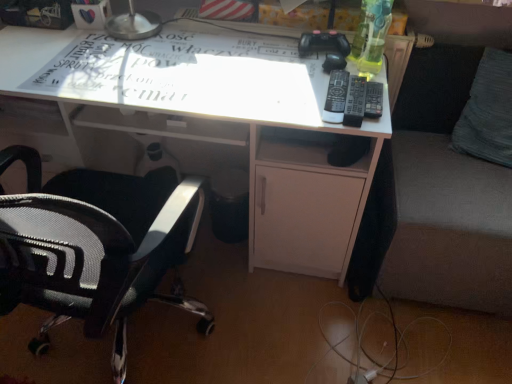
Question: Is black plastic remote at right, the 2th remote viewed from the left, aimed at black plastic remote at upper right, which ranks as the 1th remote in left-to-right order?

Choices:
 (A) no
 (B) yes

Answer: (A)

Question: Is black plastic remote at upper right, which ranks as the 1th remote in left-to-right order, at the back of black plastic remote at right, the second remote when ordered from right to left?

Choices:
 (A) yes
 (B) no

Answer: (B)

Question: Is black plastic remote at right, the second remote when ordered from right to left, beside black plastic remote at upper right, the third remote from the right?

Choices:
 (A) yes
 (B) no

Answer: (A)

Question: From the image's perspective, would you say black plastic remote at right, the second remote when ordered from right to left, is positioned over black plastic remote at upper right, the third remote from the right?

Choices:
 (A) no
 (B) yes

Answer: (A)

Question: Can you confirm if black plastic remote at right, the 2th remote viewed from the left, is taller than black plastic remote at upper right, which ranks as the 1th remote in left-to-right order?

Choices:
 (A) no
 (B) yes

Answer: (B)

Question: Relative to dark gray fabric couch at right, is white paper at center in front or behind?

Choices:
 (A) behind
 (B) front

Answer: (A)

Question: In terms of width, does white paper at center look wider or thinner when compared to dark gray fabric couch at right?

Choices:
 (A) wide
 (B) thin

Answer: (B)

Question: Is white paper at center situated inside dark gray fabric couch at right or outside?

Choices:
 (A) outside
 (B) inside

Answer: (A)

Question: From a real-world perspective, is white paper at center physically located above or below dark gray fabric couch at right?

Choices:
 (A) above
 (B) below

Answer: (A)

Question: Would you say black plastic remote at right, placed as the 1th remote when sorted from right to left, is to the left or to the right of black mesh office chair at left in the picture?

Choices:
 (A) right
 (B) left

Answer: (A)

Question: Is black plastic remote at right, placed as the 1th remote when sorted from right to left, bigger or smaller than black mesh office chair at left?

Choices:
 (A) small
 (B) big

Answer: (A)

Question: Which is correct: black plastic remote at right, the 3th remote when ordered from left to right, is inside black mesh office chair at left, or outside of it?

Choices:
 (A) outside
 (B) inside

Answer: (A)

Question: From their relative heights in the image, would you say black plastic remote at right, placed as the 1th remote when sorted from right to left, is taller or shorter than black mesh office chair at left?

Choices:
 (A) short
 (B) tall

Answer: (A)

Question: Based on their sizes in the image, would you say white glossy desk at center is bigger or smaller than black mesh office chair at left?

Choices:
 (A) small
 (B) big

Answer: (B)

Question: In the image, is white glossy desk at center on the left side or the right side of black mesh office chair at left?

Choices:
 (A) left
 (B) right

Answer: (B)